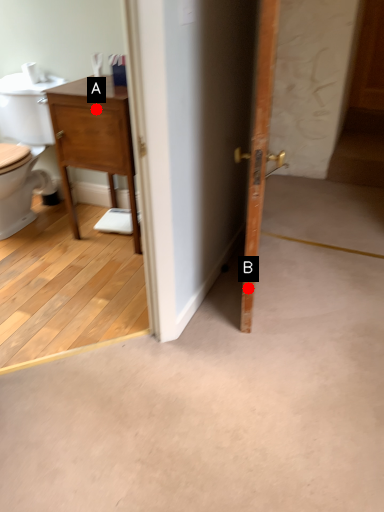
Question: Two points are circled on the image, labeled by A and B beside each circle. Which point appears farthest from the camera in this image?

Choices:
 (A) A is further
 (B) B is further

Answer: (A)